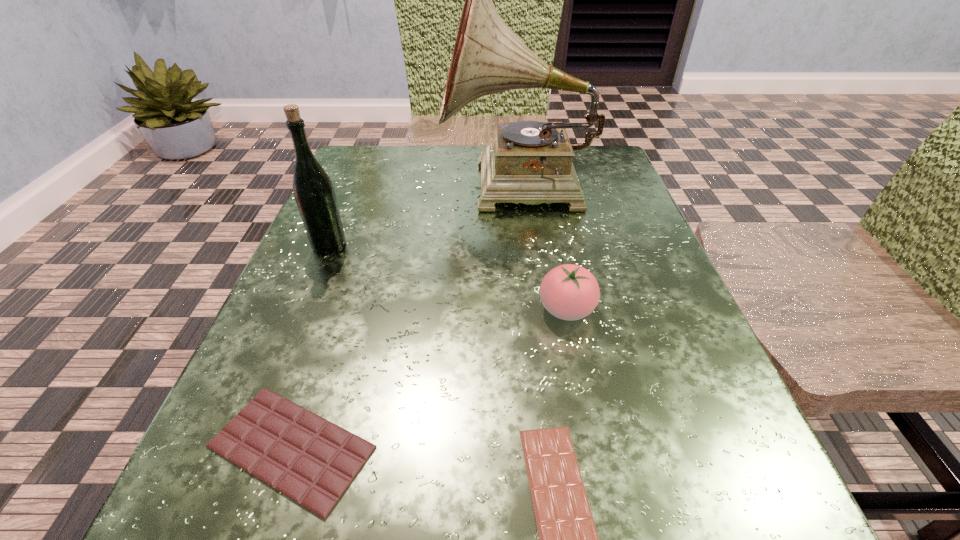
Image resolution: width=960 pixels, height=540 pixels. I want to click on blank area located from the horn of the record player, so click(x=372, y=188).

This screenshot has width=960, height=540. I want to click on vacant point located on the right of the fourth shortest object, so click(x=569, y=247).

This screenshot has height=540, width=960. In order to click on vacant space located on the left of the third tallest object in this screenshot , I will do `click(453, 309)`.

Locate an element on the screen. free space located 0.340m on the right of the left chocolate bar is located at coordinates (670, 447).

Find the location of a particular element. Image resolution: width=960 pixels, height=540 pixels. object located in the far edge section of the desktop is located at coordinates (530, 162).

Find the location of a particular element. Image resolution: width=960 pixels, height=540 pixels. object present at the near edge is located at coordinates (312, 461).

Identify the location of beer bottle positioned at the left edge. (314, 193).

Locate an element on the screen. This screenshot has height=540, width=960. chocolate bar that is at the left edge is located at coordinates (312, 461).

The image size is (960, 540). Identify the location of record player that is at the right edge. (530, 162).

The height and width of the screenshot is (540, 960). I want to click on tomato that is at the right edge, so click(570, 292).